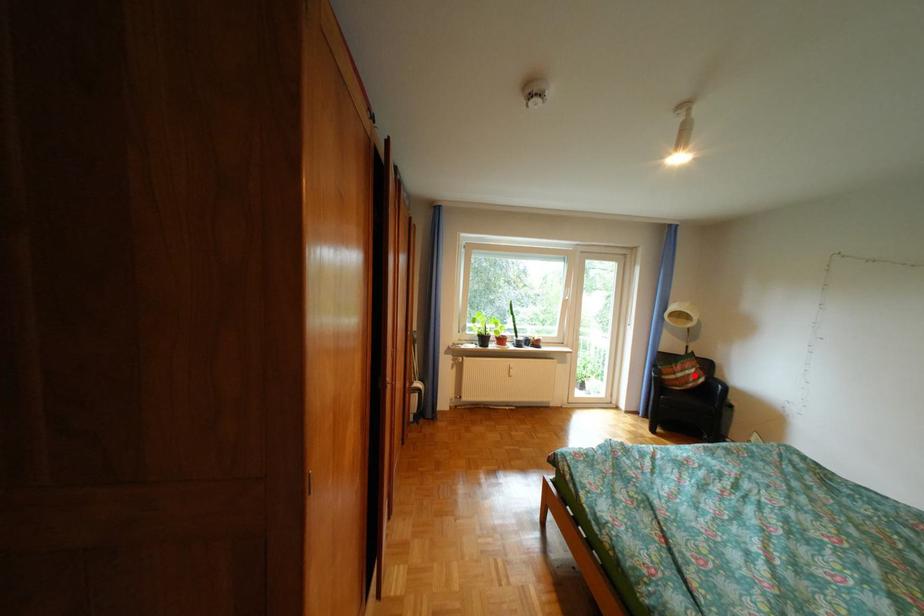
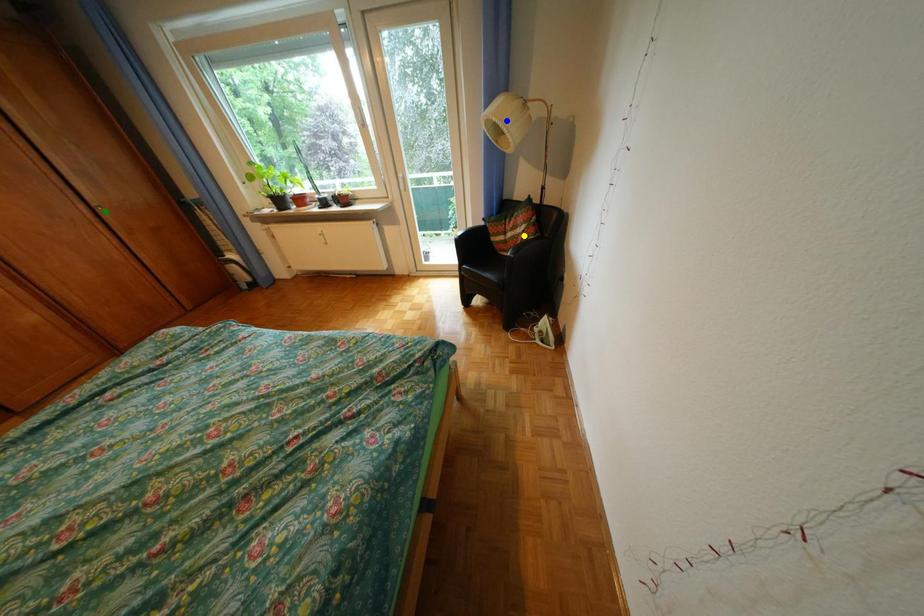
Question: I am providing you with two images of the same scene from different viewpoints. A red point is marked on the first image. You are given multiple points on the second image. Which point in image 2 is actually the same real-world point as the red point in image 1?

Choices:
 (A) green point
 (B) yellow point
 (C) blue point

Answer: (B)